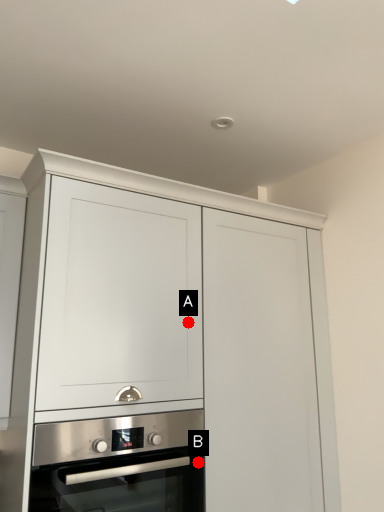
Question: Two points are circled on the image, labeled by A and B beside each circle. Among these points, which one is nearest to the camera?

Choices:
 (A) A is closer
 (B) B is closer

Answer: (B)